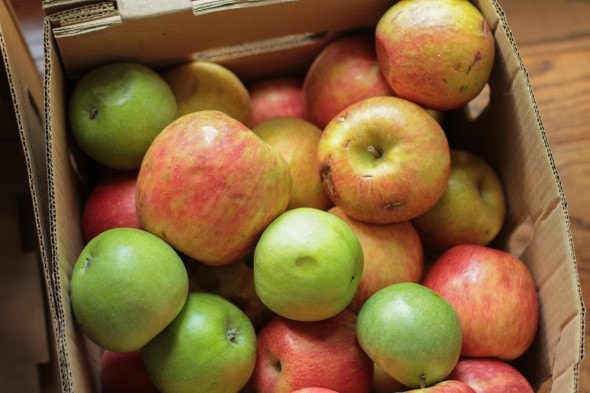
Where is `floor`? floor is located at coordinates (550, 106).